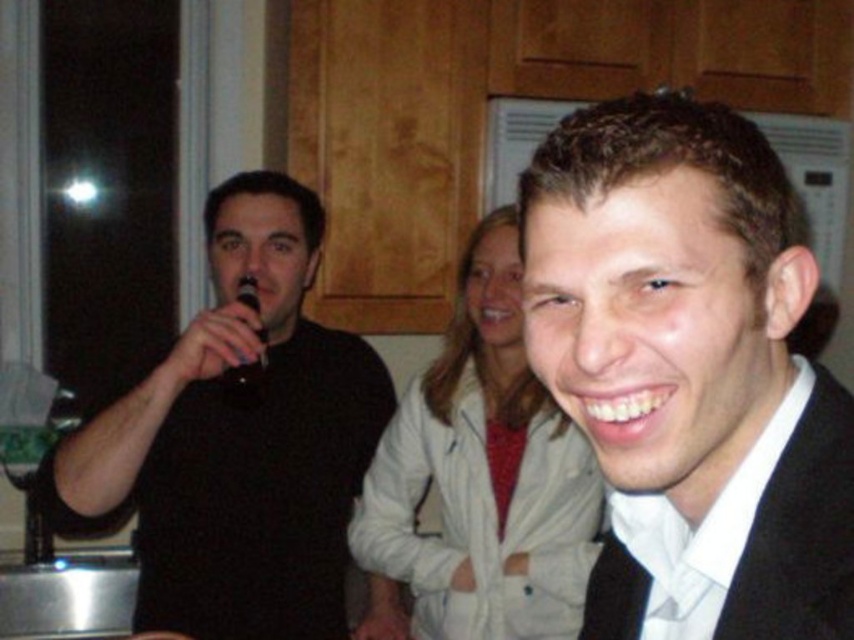
Question: Does black matte microphone at left have a smaller size compared to black plastic microphone at left?

Choices:
 (A) no
 (B) yes

Answer: (A)

Question: Among these points, which one is farthest from the camera?

Choices:
 (A) click(806, 422)
 (B) click(253, 301)

Answer: (B)

Question: Is black matte suit at center to the left of black plastic microphone at left from the viewer's perspective?

Choices:
 (A) no
 (B) yes

Answer: (A)

Question: Which object is farther from the camera taking this photo?

Choices:
 (A) black matte suit at center
 (B) black matte microphone at left
 (C) black plastic microphone at left

Answer: (C)

Question: Which object appears farthest from the camera in this image?

Choices:
 (A) black matte suit at center
 (B) black matte microphone at left

Answer: (B)

Question: Observing the image, what is the correct spatial positioning of black matte microphone at left in reference to black plastic microphone at left?

Choices:
 (A) below
 (B) above

Answer: (A)